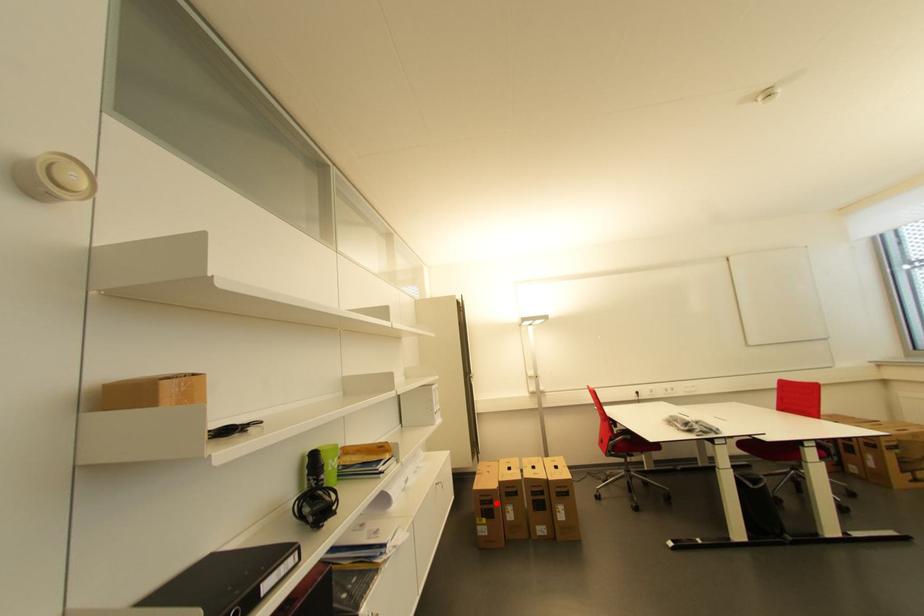
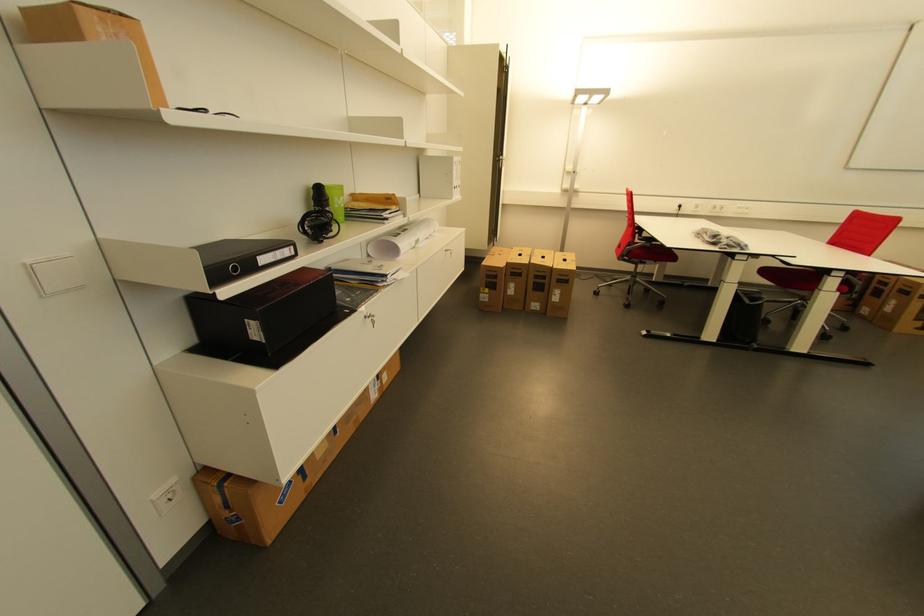
Question: A red point is marked in image1. In image2, is the corresponding 3D point closer to the camera or farther? Reply with the corresponding letter.

Choices:
 (A) The corresponding 3D point is closer.
 (B) The corresponding 3D point is farther.

Answer: (A)